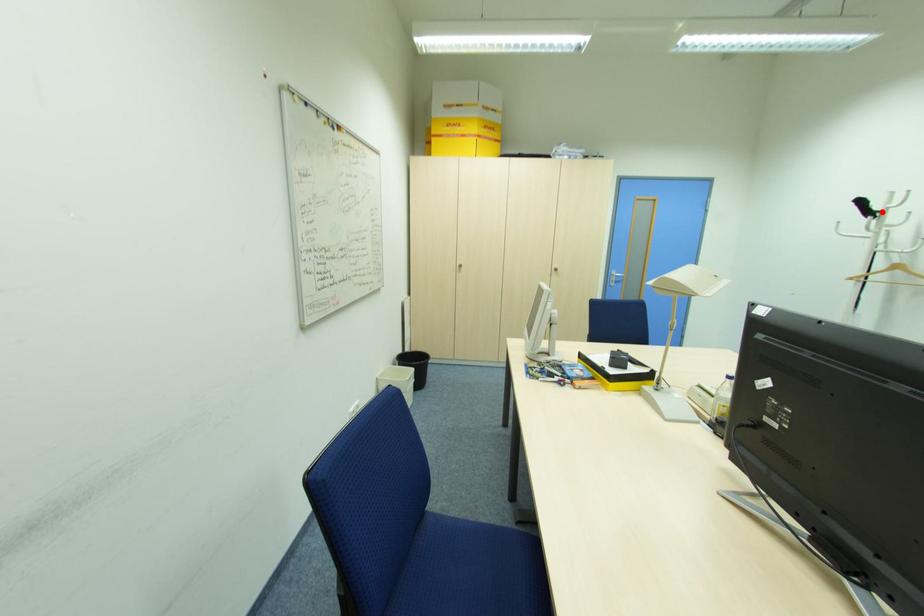
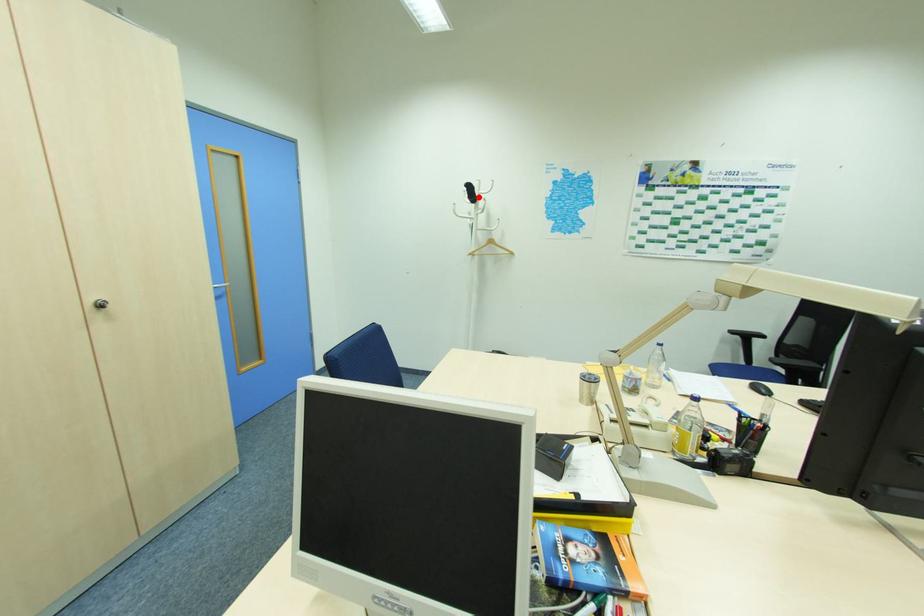
I am providing you with two images of the same scene from different viewpoints. A red point is marked on the first image and another point is marked on the second image. Is the marked point in image1 the same physical position as the marked point in image2?

Yes